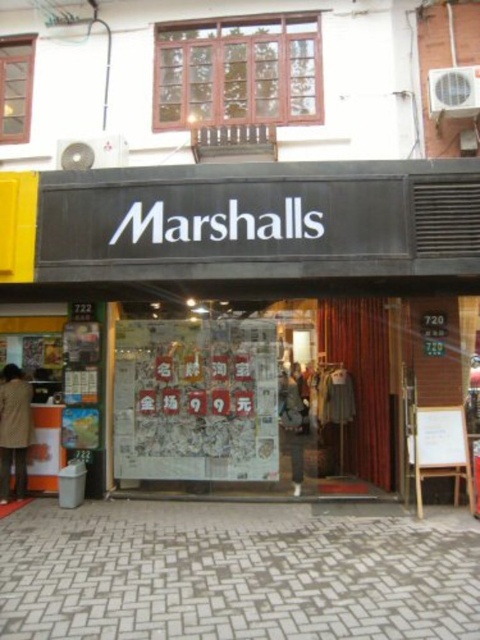
Question: Is wooden frame at upper center bigger than clear glass window at upper left?

Choices:
 (A) yes
 (B) no

Answer: (A)

Question: Is matte black clothing store at center below beige wool coat at lower left?

Choices:
 (A) yes
 (B) no

Answer: (A)

Question: Is matte black clothing store at center bigger than wooden frame at upper center?

Choices:
 (A) yes
 (B) no

Answer: (A)

Question: Which object is closer to the camera taking this photo?

Choices:
 (A) wooden frame at upper center
 (B) beige wool coat at lower left

Answer: (B)

Question: Among these objects, which one is farthest from the camera?

Choices:
 (A) beige wool coat at lower left
 (B) matte black clothing store at center
 (C) clear glass window at upper left
 (D) wooden frame at upper center

Answer: (C)

Question: Which object is the closest to the matte black clothing store at center?

Choices:
 (A) wooden frame at upper center
 (B) clear glass window at upper left

Answer: (A)